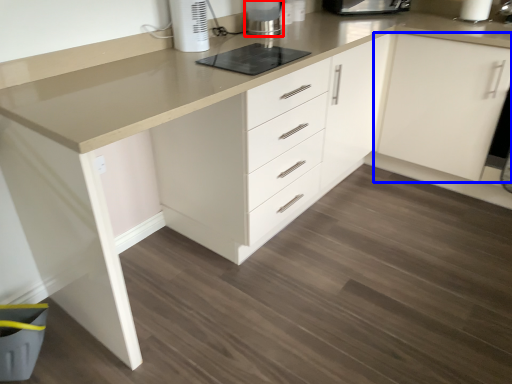
Question: Which object is closer to the camera taking this photo, home appliance (highlighted by a red box) or cabinetry (highlighted by a blue box)?

Choices:
 (A) home appliance
 (B) cabinetry

Answer: (B)